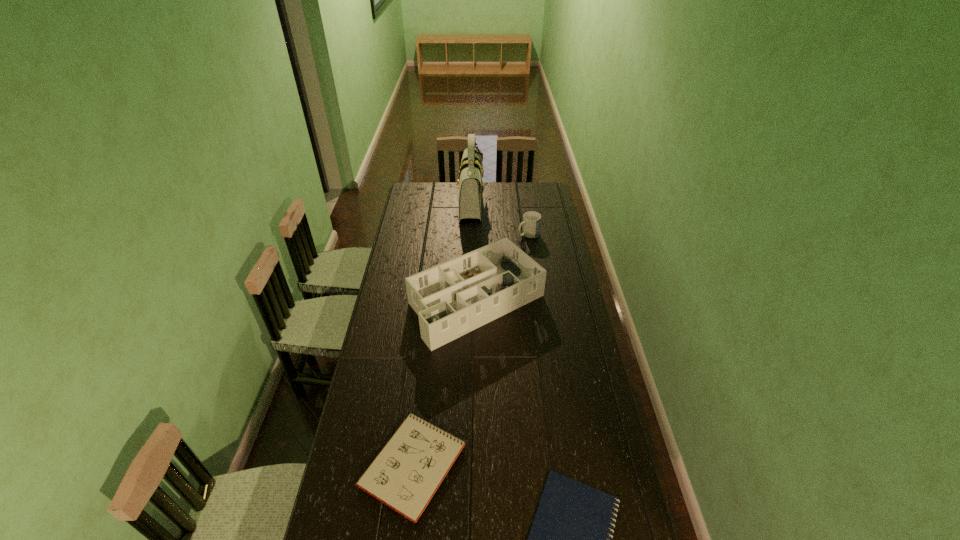
In order to click on free space that is in between the taller notepad and the second tallest object in this screenshot , I will do `click(445, 381)`.

You are a GUI agent. You are given a task and a screenshot of the screen. Output one action in this format:
    pyautogui.click(x=<x>, y=<y>)
    Task: Click on the empty space that is in between the tallest object and the mug
    This screenshot has width=960, height=540.
    Given the screenshot: What is the action you would take?
    pyautogui.click(x=499, y=218)

Where is `vacant area between the third shortest object and the farthest object`? vacant area between the third shortest object and the farthest object is located at coordinates pos(499,218).

At what (x,y) coordinates should I click in order to perform the action: click on vacant point located between the mug and the fourth tallest object. Please return your answer as a coordinate pair (x, y). The width and height of the screenshot is (960, 540). Looking at the image, I should click on (471, 349).

Locate which object ranks in proximity to the fourth shortest object. Please provide its 2D coordinates. Your answer should be formatted as a tuple, i.e. [(x, y)], where the tuple contains the x and y coordinates of a point satisfying the conditions above.

[(531, 220)]

The image size is (960, 540). I want to click on object that is the fourth closest to the taller notepad, so click(x=471, y=187).

At what (x,y) coordinates should I click in order to perform the action: click on blank space that satisfies the following two spatial constraints: 1. on the front-facing side of the second tallest object; 2. on the left side of the satchel. Please return your answer as a coordinate pair (x, y). The image size is (960, 540). Looking at the image, I should click on (468, 299).

Find the location of a particular element. blank space that satisfies the following two spatial constraints: 1. on the front-facing side of the third farthest object; 2. on the right side of the tallest object is located at coordinates (468, 299).

At what (x,y) coordinates should I click in order to perform the action: click on vacant space that satisfies the following two spatial constraints: 1. on the back side of the dollhouse; 2. on the front-facing side of the farthest object. Please return your answer as a coordinate pair (x, y). The width and height of the screenshot is (960, 540). Looking at the image, I should click on (477, 202).

The height and width of the screenshot is (540, 960). Identify the location of vacant area in the image that satisfies the following two spatial constraints: 1. on the back side of the mug; 2. on the front-facing side of the satchel. (524, 202).